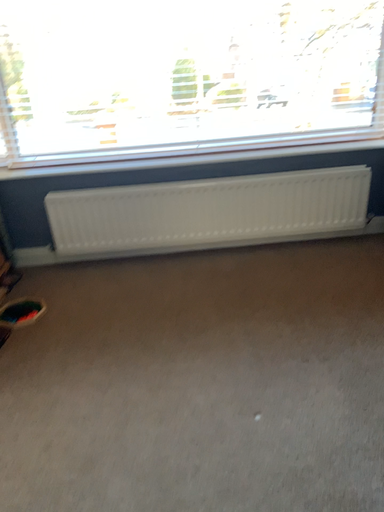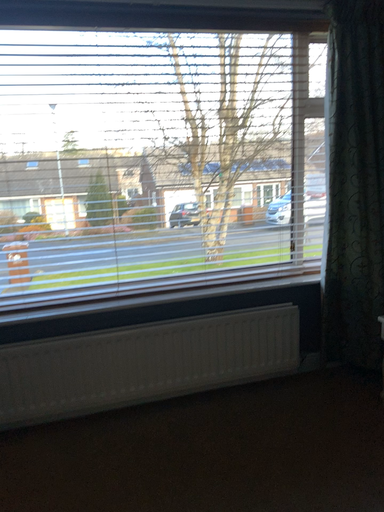
Question: How did the camera likely rotate when shooting the video?

Choices:
 (A) rotated right
 (B) rotated left

Answer: (A)